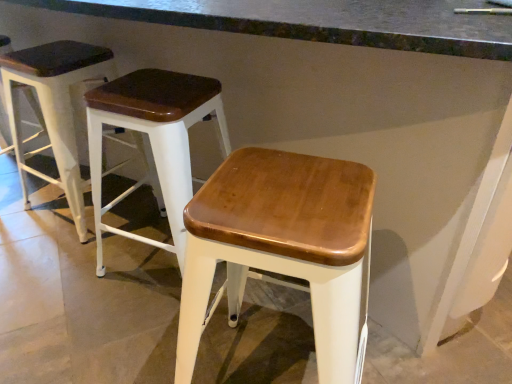
Question: In terms of height, does wooden seat at center, the 2th stool from the left, look taller or shorter compared to wooden seat stool at left, the third stool in the right-to-left sequence?

Choices:
 (A) short
 (B) tall

Answer: (A)

Question: Based on their sizes in the image, would you say wooden seat at center, the 2th stool from the left, is bigger or smaller than wooden seat stool at left, the third stool in the right-to-left sequence?

Choices:
 (A) big
 (B) small

Answer: (A)

Question: Estimate the real-world distances between objects in this image. Which object is farther from the wooden seat at center, the second stool in the right-to-left sequence?

Choices:
 (A) wooden seat at center, the third stool when ordered from left to right
 (B) wooden seat stool at left, the third stool in the right-to-left sequence
 (C) smooth concrete at center

Answer: (A)

Question: Which object is positioned closest to the wooden seat at center, the 1th stool positioned from the right?

Choices:
 (A) wooden seat at center, the 2th stool from the left
 (B) smooth concrete at center
 (C) wooden seat stool at left, which is the first stool in left-to-right order

Answer: (A)